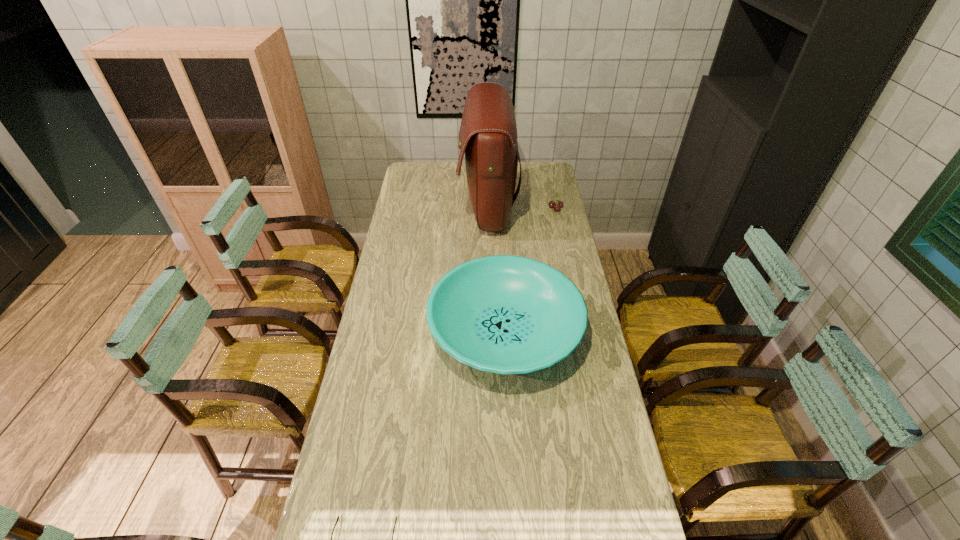
Locate an element on the screen. This screenshot has width=960, height=540. the tallest object is located at coordinates (488, 135).

Identify the location of the second nearest object. Image resolution: width=960 pixels, height=540 pixels. (504, 314).

Locate an element on the screen. dish is located at coordinates (504, 314).

Find the location of a particular element. the second shortest object is located at coordinates (557, 206).

You are a GUI agent. You are given a task and a screenshot of the screen. Output one action in this format:
    pyautogui.click(x=<x>, y=<y>)
    Task: Click on the blank space located on the open flap of the satchel
    Image resolution: width=960 pixels, height=540 pixels.
    Given the screenshot: What is the action you would take?
    pyautogui.click(x=418, y=208)

Where is `free spot located on the open flap of the satchel`? This screenshot has height=540, width=960. free spot located on the open flap of the satchel is located at coordinates (411, 208).

Image resolution: width=960 pixels, height=540 pixels. I want to click on free location located 0.220m on the open flap of the satchel, so click(414, 208).

Where is `free space located 0.140m on the front of the second nearest object`? Image resolution: width=960 pixels, height=540 pixels. free space located 0.140m on the front of the second nearest object is located at coordinates (511, 440).

The image size is (960, 540). I want to click on vacant space located 0.060m on the leaves of the second shortest object, so click(x=536, y=208).

This screenshot has height=540, width=960. Identify the location of vacant space located 0.220m on the leaves of the second shortest object. (503, 208).